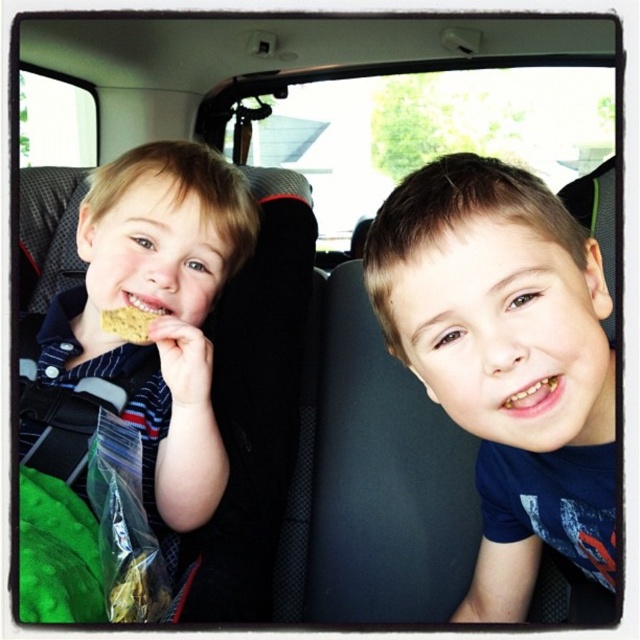
Where is the matte brown hair at left located in the image?

The matte brown hair at left is located at point (148, 330).

You are standing 2 feet away from the car window. Can you reach the point marked at coordinates (392, 268) inside the car?

The point marked at coordinates (392, 268) is 21.21 inches away from the viewer. Since you are standing 2 feet away from the car window, which is equivalent to 24 inches, you can reach the point marked at coordinates (392, 268) because your distance is greater than the required distance.

You are a photographer standing 24 inches away from the car window. You want to take a clear photo of the blue matte shirt at center. Is the current distance sufficient to capture the shirt in focus without moving closer?

The blue matte shirt at center is 18.60 inches away from the viewer. Since you are standing 24 inches away from the car window, the total distance between you and the shirt would be 24 inches plus the distance from the window to the shirt inside the car. However, the description only provides the shirt being 18.60 inches from the viewer, which likely refers to the distance from the photographer to the shirt through the window. If the photographer is 24 inches away from the window, the total distance would 2